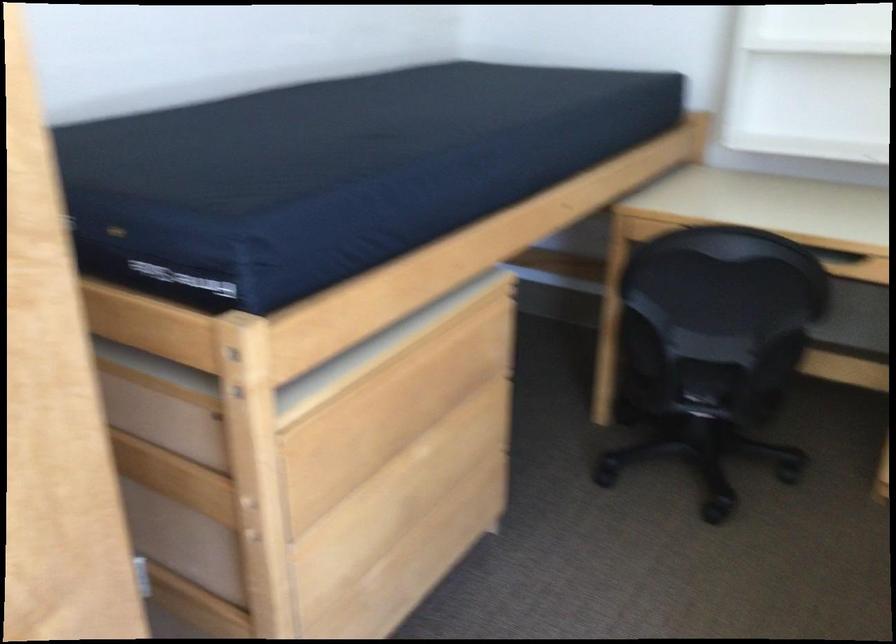
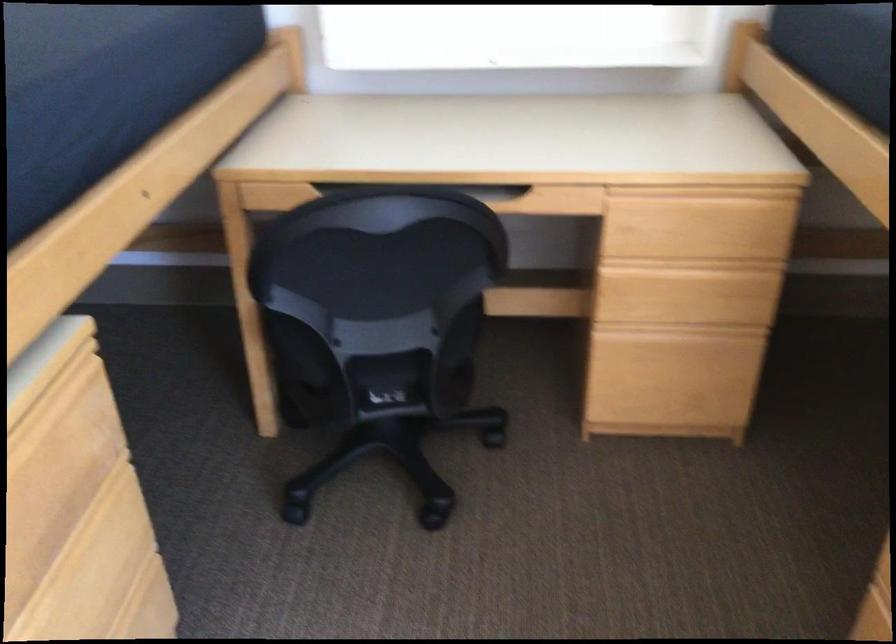
Question: The images are taken continuously from a first-person perspective. In which direction are you moving?

Choices:
 (A) Left
 (B) Right
 (C) Forward
 (D) Backward

Answer: (C)